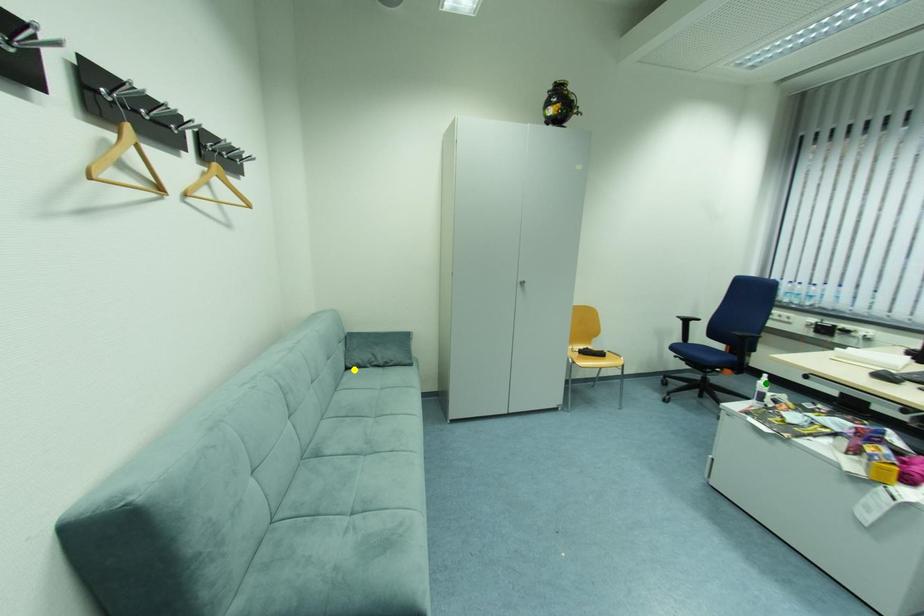
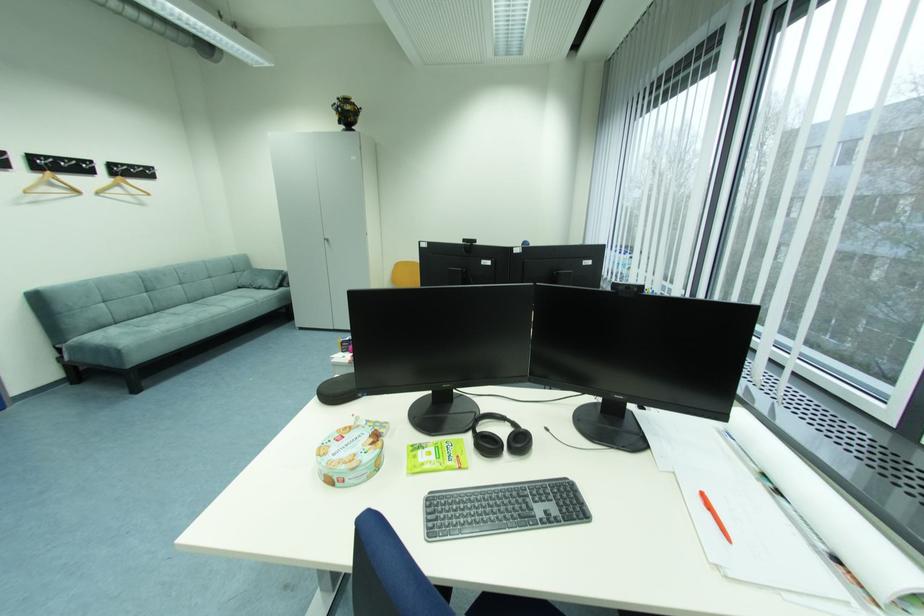
I am providing you with two images of the same scene from different viewpoints. Three points are marked in image1. Which point corresponds to a part or object that is occluded in image2?In image1, three points are marked. Which of them correspond to a part or object that is occluded in image2?Among the three points shown in image1, which one corresponds to a part or object that is no longer visible due to occlusion in image2?

blue point, green point